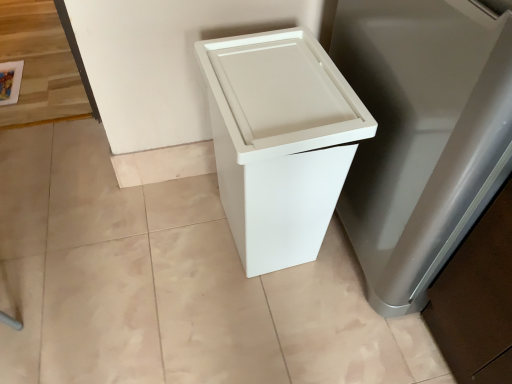
Question: From the image's perspective, does white plastic trash can at lower right appear lower than white matte trash can at center?

Choices:
 (A) yes
 (B) no

Answer: (B)

Question: Is white plastic trash can at lower right oriented away from white matte trash can at center?

Choices:
 (A) yes
 (B) no

Answer: (A)

Question: Is white plastic trash can at lower right wider than white matte trash can at center?

Choices:
 (A) yes
 (B) no

Answer: (A)

Question: Would you say white plastic trash can at lower right contains white matte trash can at center?

Choices:
 (A) no
 (B) yes

Answer: (A)

Question: Can you confirm if white plastic trash can at lower right is thinner than white matte trash can at center?

Choices:
 (A) no
 (B) yes

Answer: (A)

Question: Is white plastic trash can at lower right further to camera compared to white matte trash can at center?

Choices:
 (A) yes
 (B) no

Answer: (B)

Question: Can you confirm if white matte trash can at center is bigger than white plastic trash can at lower right?

Choices:
 (A) yes
 (B) no

Answer: (B)

Question: Is white matte trash can at center facing towards white plastic trash can at lower right?

Choices:
 (A) no
 (B) yes

Answer: (A)

Question: From a real-world perspective, is white matte trash can at center on white plastic trash can at lower right?

Choices:
 (A) yes
 (B) no

Answer: (B)

Question: From a real-world perspective, is white matte trash can at center beneath white plastic trash can at lower right?

Choices:
 (A) no
 (B) yes

Answer: (B)

Question: Is white matte trash can at center positioned before white plastic trash can at lower right?

Choices:
 (A) no
 (B) yes

Answer: (A)

Question: Does white matte trash can at center have a lesser width compared to white plastic trash can at lower right?

Choices:
 (A) no
 (B) yes

Answer: (B)

Question: From a real-world perspective, is white plastic trash can at lower right above or below white matte trash can at center?

Choices:
 (A) above
 (B) below

Answer: (A)